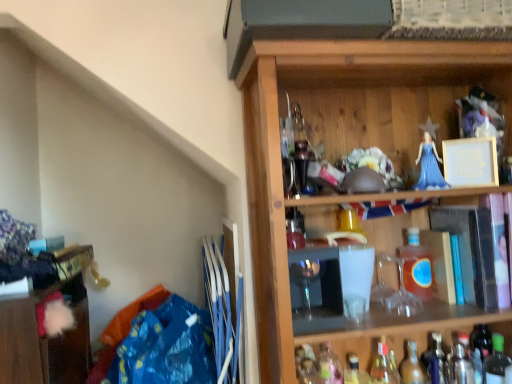
Locate an element on the screen. vacant point above wooden shelf at upper right (from a real-world perspective) is located at coordinates (395, 70).